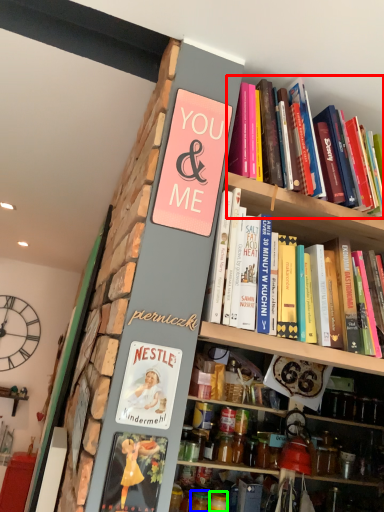
Question: Based on their relative distances, which object is farther from book (highlighted by a red box)? Choose from glass jar (highlighted by a blue box) and glass jar (highlighted by a green box).

Choices:
 (A) glass jar
 (B) glass jar

Answer: (B)